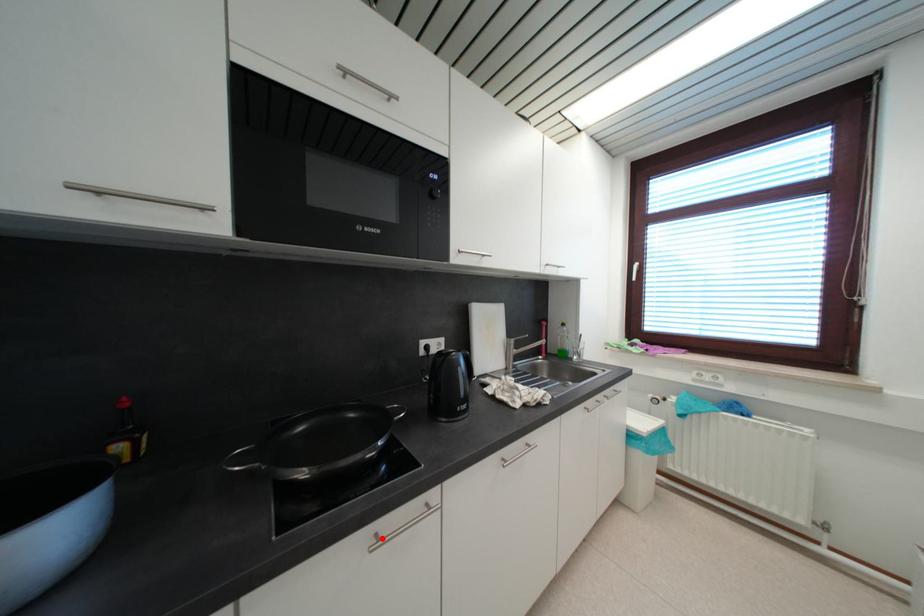
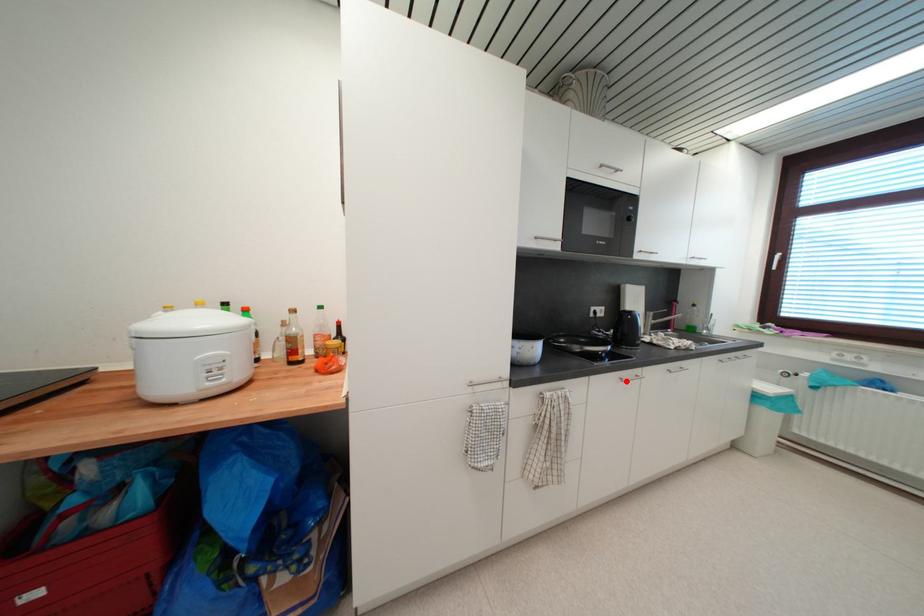
Looking at this image, I am providing you with two images of the same scene from different viewpoints. A red point is marked on the first image and another point is marked on the second image. Is the red point in image1 aligned with the point shown in image2?

Yes